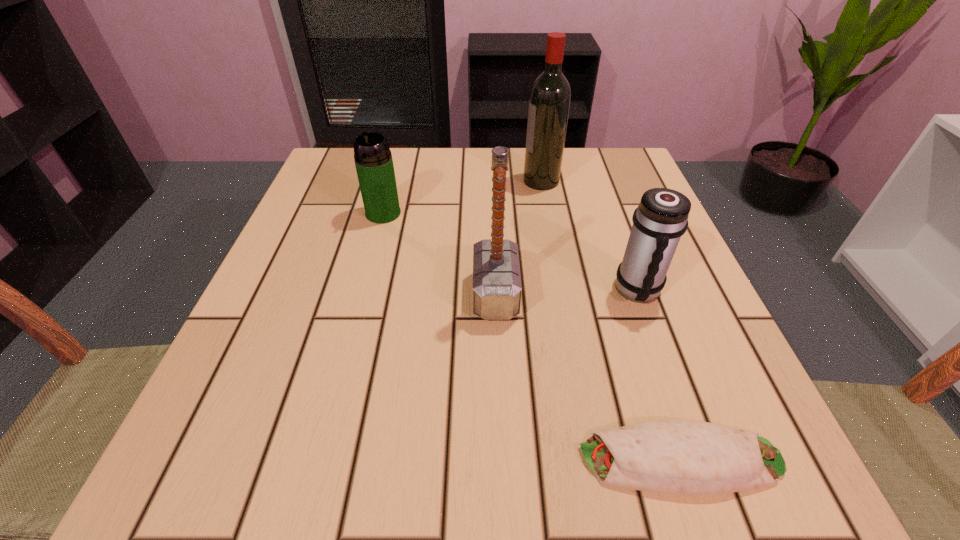
This screenshot has height=540, width=960. Find the location of `free space at the far left corner of the desktop`. free space at the far left corner of the desktop is located at coordinates (334, 152).

The width and height of the screenshot is (960, 540). In order to click on vacant space at the near left corner of the desktop in this screenshot , I will do `click(193, 428)`.

Find the location of a particular element. The height and width of the screenshot is (540, 960). vacant region at the far right corner of the desktop is located at coordinates (598, 150).

Where is `free space between the right thermos bottle and the shortest object`? free space between the right thermos bottle and the shortest object is located at coordinates (660, 375).

Find the location of a particular element. The height and width of the screenshot is (540, 960). free space between the farthest object and the left thermos bottle is located at coordinates (462, 197).

Locate an element on the screen. The image size is (960, 540). empty space that is in between the nearer thermos bottle and the burrito is located at coordinates (660, 375).

Find the location of `blank region between the right thermos bottle and the hammer`. blank region between the right thermos bottle and the hammer is located at coordinates (567, 292).

Image resolution: width=960 pixels, height=540 pixels. I want to click on free space between the hammer and the farthest object, so click(x=518, y=238).

At what (x,y) coordinates should I click in order to perform the action: click on vacant space that's between the burrito and the wine bottle. Please return your answer as a coordinate pair (x, y). This screenshot has width=960, height=540. Looking at the image, I should click on (611, 320).

The width and height of the screenshot is (960, 540). What are the coordinates of `vacant region between the fourth object from right to left and the nearest object` in the screenshot? It's located at (588, 377).